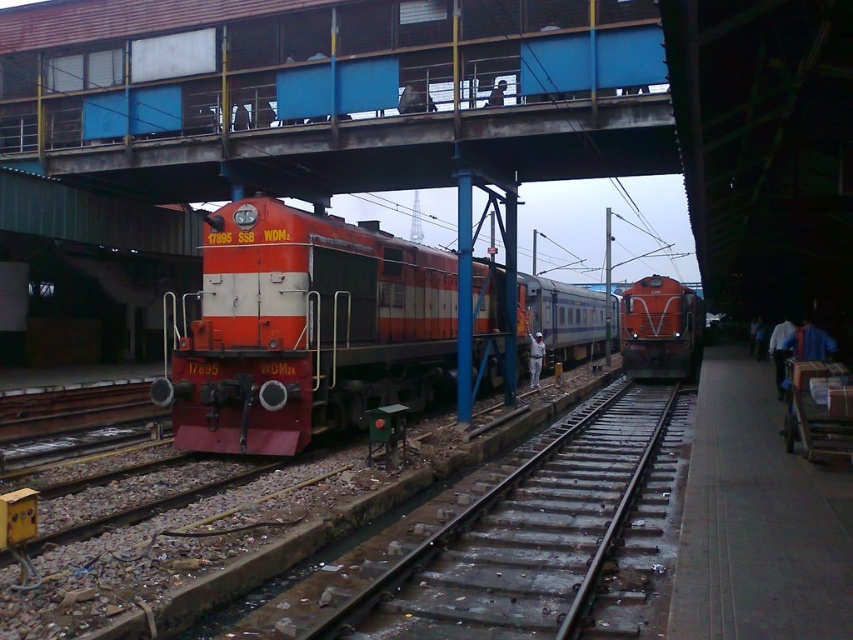
Who is taller, rusty metal bridge at upper center or metal/rough train track at center?

rusty metal bridge at upper center is taller.

Does rusty metal bridge at upper center have a greater height compared to metal/rough train track at center?

Indeed, rusty metal bridge at upper center has a greater height compared to metal/rough train track at center.

Between point (13, 56) and point (604, 406), which one is positioned in front?

Point (13, 56) is more forward.

Identify the location of rusty metal bridge at upper center. (354, 88).

Is orange matte train at center positioned in front of metal/rough train track at center?

No, it is not.

Who is more forward, (256, 390) or (573, 500)?

Positioned in front is point (573, 500).

This screenshot has height=640, width=853. Identify the location of orange matte train at center. (322, 328).

Which is more to the right, rusty metal bridge at upper center or orange matte train at center?

orange matte train at center

Does rusty metal bridge at upper center appear over orange matte train at center?

Indeed, rusty metal bridge at upper center is positioned over orange matte train at center.

Image resolution: width=853 pixels, height=640 pixels. Identify the location of rusty metal bridge at upper center. (354, 88).